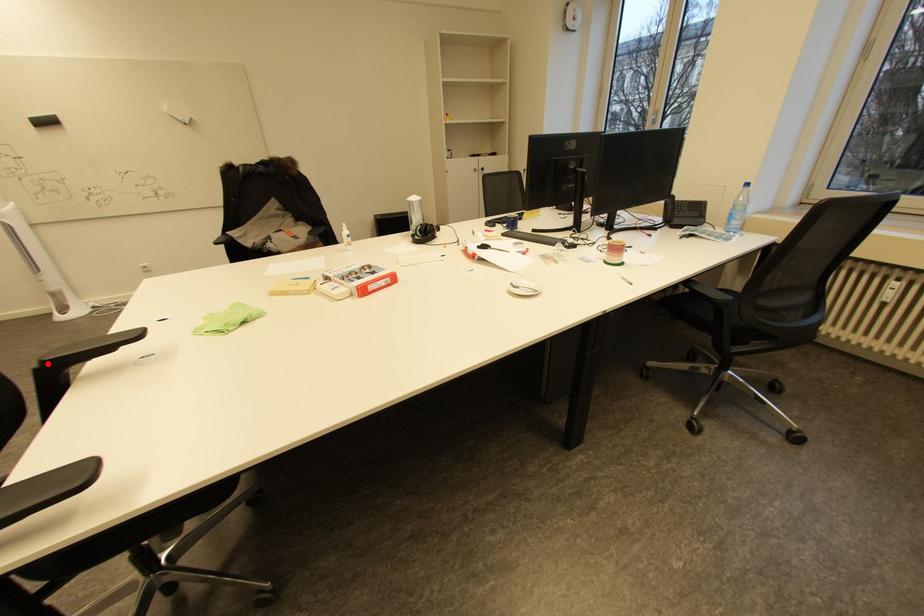
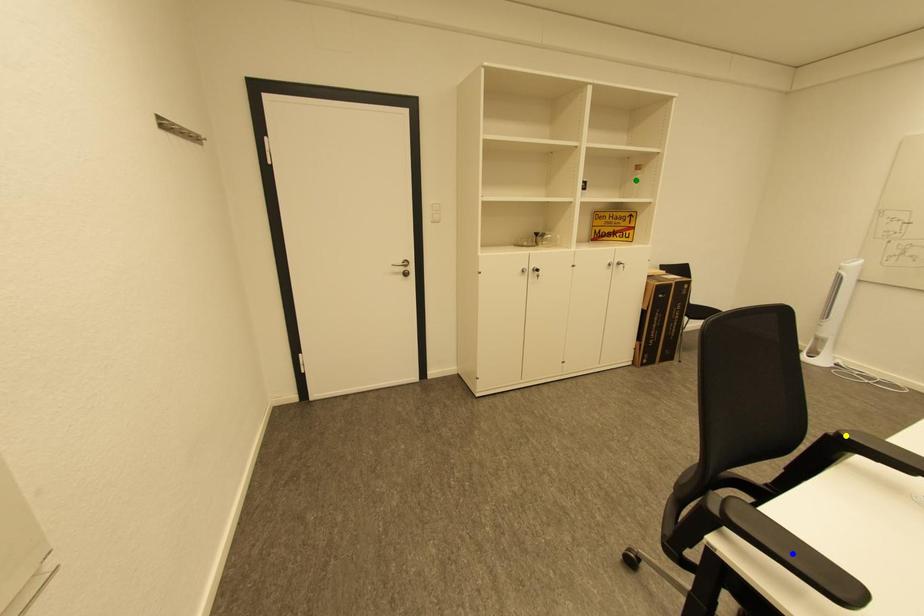
Question: I am providing you with two images of the same scene from different viewpoints. A red point is marked on the first image. You are given multiple points on the second image. Which point in image 2 represents the same 3d spot as the red point in image 1?

Choices:
 (A) blue point
 (B) yellow point
 (C) green point

Answer: (B)